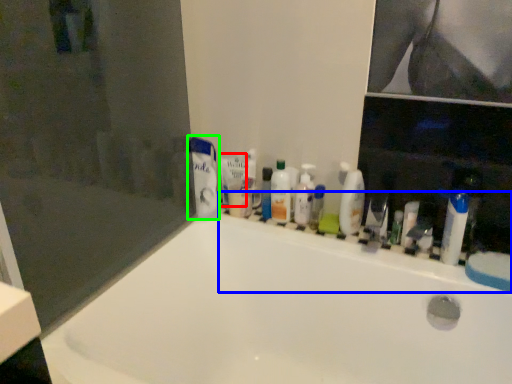
Question: Estimate the real-world distances between objects in this image. Which object is closer to toothpaste (highlighted by a red box), ledge (highlighted by a blue box) or toothpaste (highlighted by a green box)?

Choices:
 (A) ledge
 (B) toothpaste

Answer: (B)